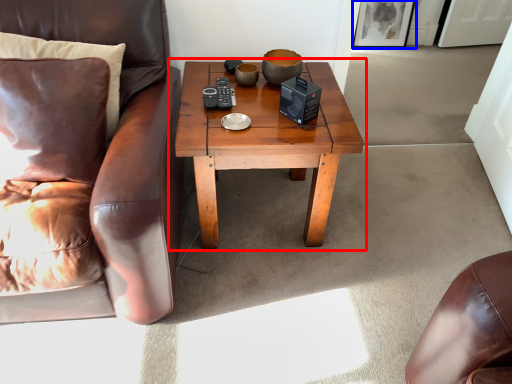
Question: Which object appears farthest to the camera in this image, coffee table (highlighted by a red box) or picture frame (highlighted by a blue box)?

Choices:
 (A) coffee table
 (B) picture frame

Answer: (B)